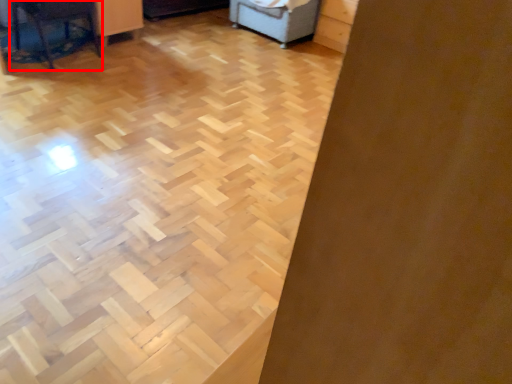
Question: From the image's perspective, where is furniture (annotated by the red box) located in relation to furniture in the image?

Choices:
 (A) above
 (B) below

Answer: (B)